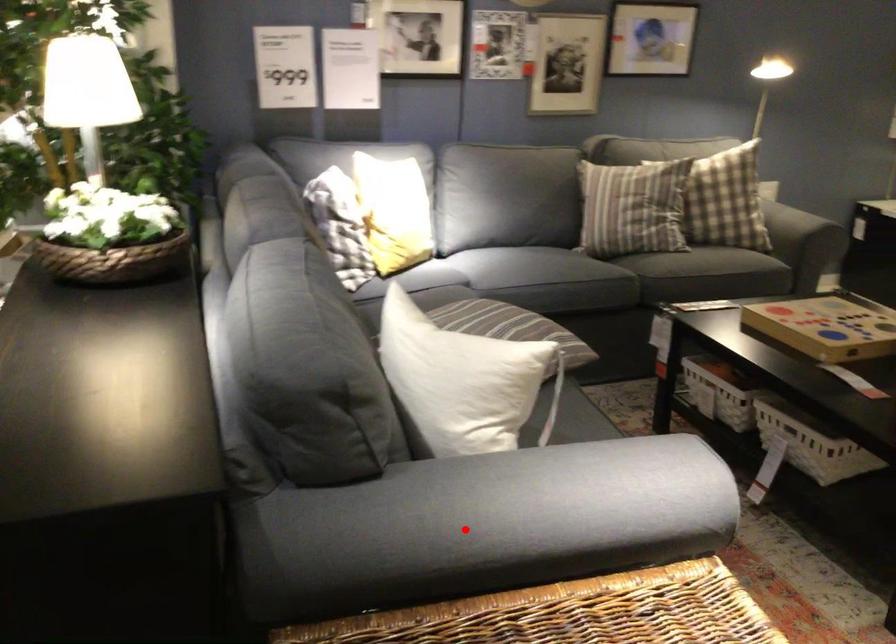
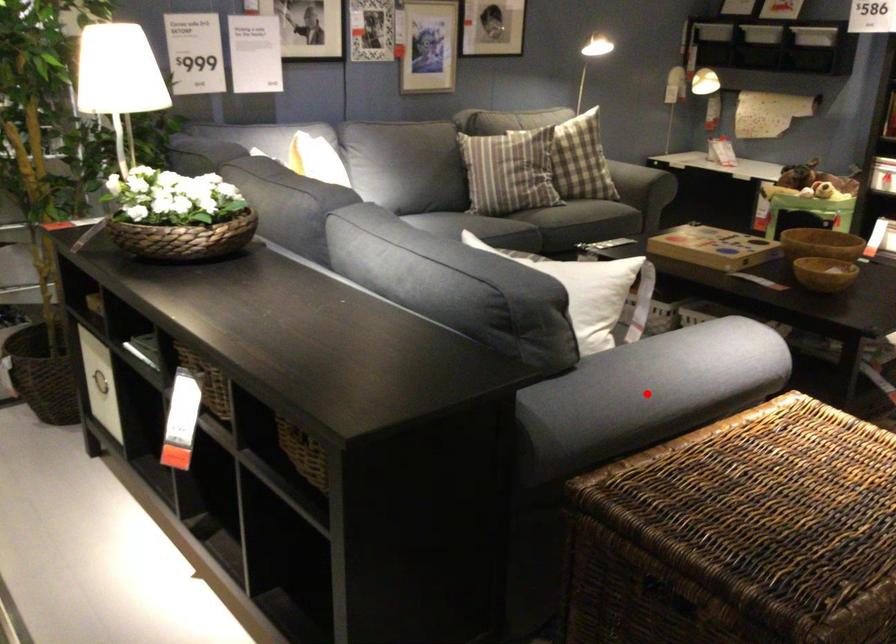
I am providing you with two images of the same scene from different viewpoints. A red point is marked on the first image and another point is marked on the second image. Are the points marked in image1 and image2 representing the same 3D position?

Yes